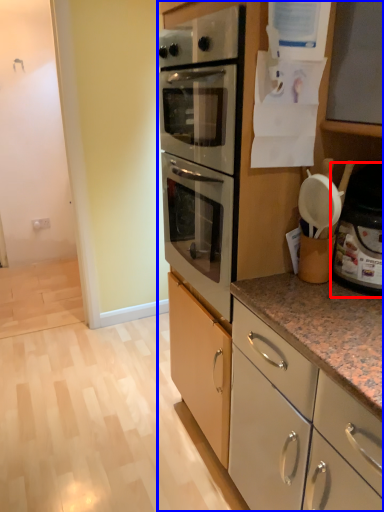
Question: Which object is closer to the camera taking this photo, appliance (highlighted by a red box) or cabinetry (highlighted by a blue box)?

Choices:
 (A) appliance
 (B) cabinetry

Answer: (B)